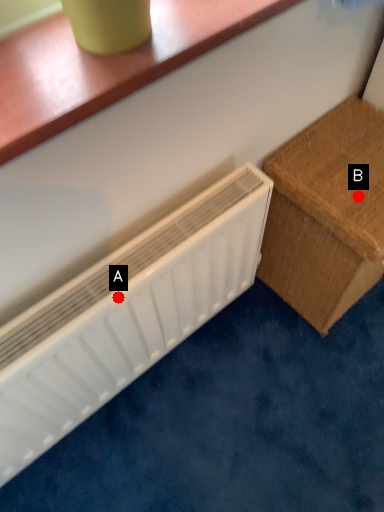
Question: Two points are circled on the image, labeled by A and B beside each circle. Which point is farther to the camera?

Choices:
 (A) A is further
 (B) B is further

Answer: (B)